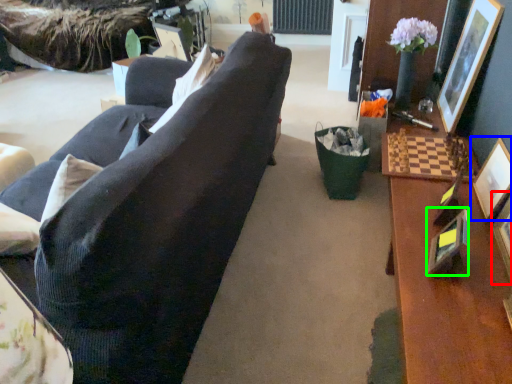
Question: Based on their relative distances, which object is nearer to picture frame (highlighted by a red box)? Choose from picture frame (highlighted by a blue box) and picture frame (highlighted by a green box).

Choices:
 (A) picture frame
 (B) picture frame

Answer: (A)